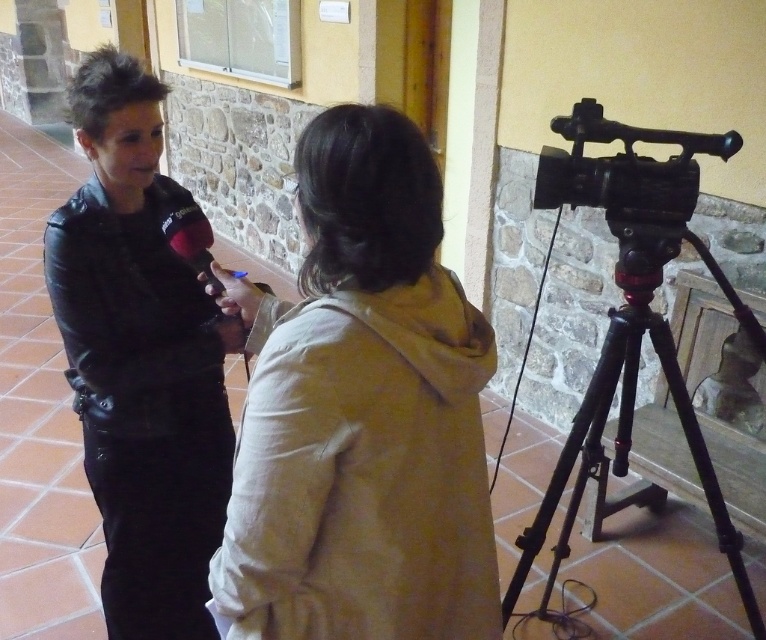
Question: Which point is farther to the camera?

Choices:
 (A) black metal tripod at right
 (B) beige cotton hoodie at center
 (C) matte black jacket at left

Answer: (C)

Question: Among these points, which one is nearest to the camera?

Choices:
 (A) (218, 273)
 (B) (92, 74)

Answer: (A)

Question: Is black metal tripod at right wider than black plastic video camera at right?

Choices:
 (A) yes
 (B) no

Answer: (A)

Question: Which object is closer to the camera taking this photo?

Choices:
 (A) matte black jacket at left
 (B) black plastic video camera at right
 (C) beige cotton hoodie at center
 (D) black metal tripod at right

Answer: (C)

Question: Can you confirm if black metal tripod at right is positioned below black plastic video camera at right?

Choices:
 (A) yes
 (B) no

Answer: (A)

Question: Is matte black jacket at left bigger than black metal tripod at right?

Choices:
 (A) no
 (B) yes

Answer: (A)